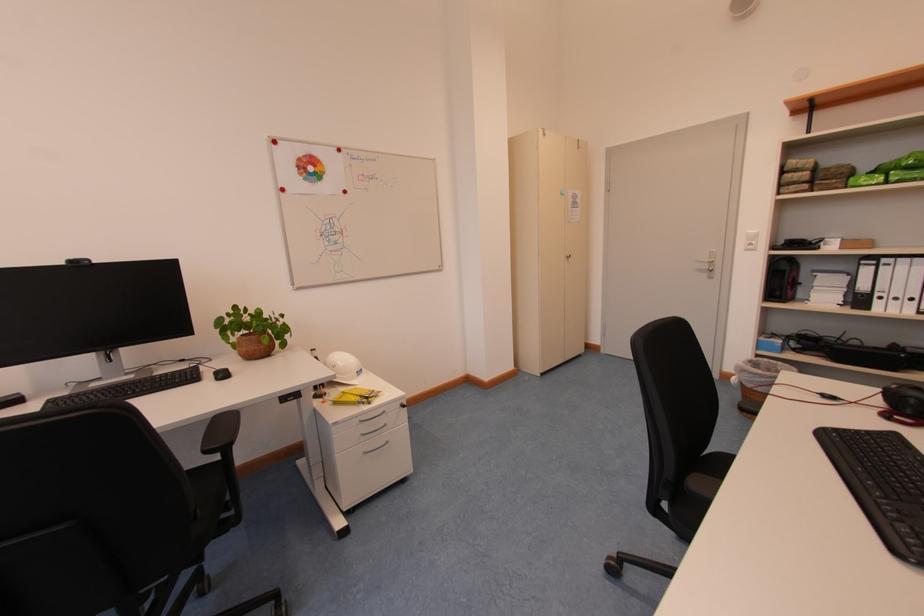
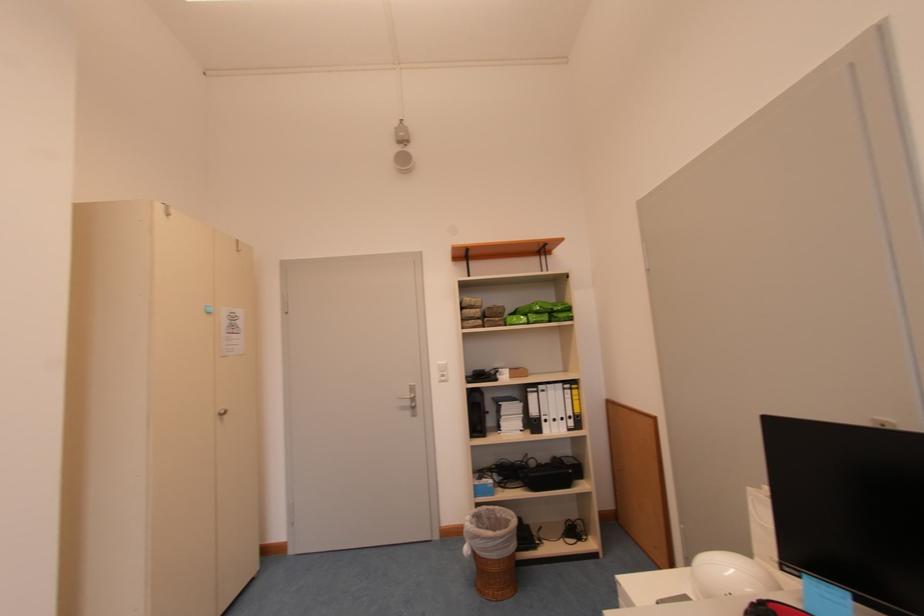
The point at (x=870, y=265) is marked in the first image. Where is the corresponding point in the second image?

(536, 392)